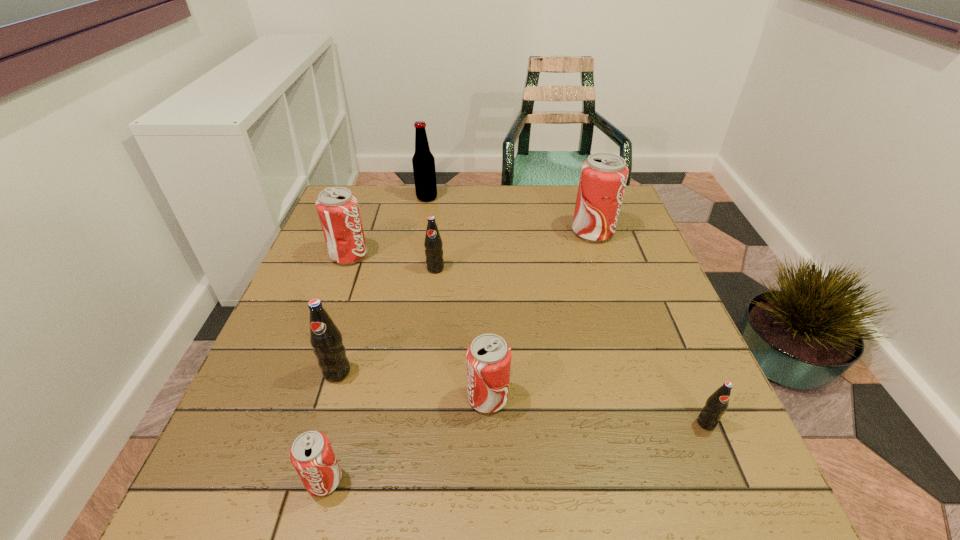
Image resolution: width=960 pixels, height=540 pixels. I want to click on vacant space that satisfies the following two spatial constraints: 1. on the front label of the second nearest pink soda can; 2. on the left side of the leftmost black pop, so click(x=329, y=398).